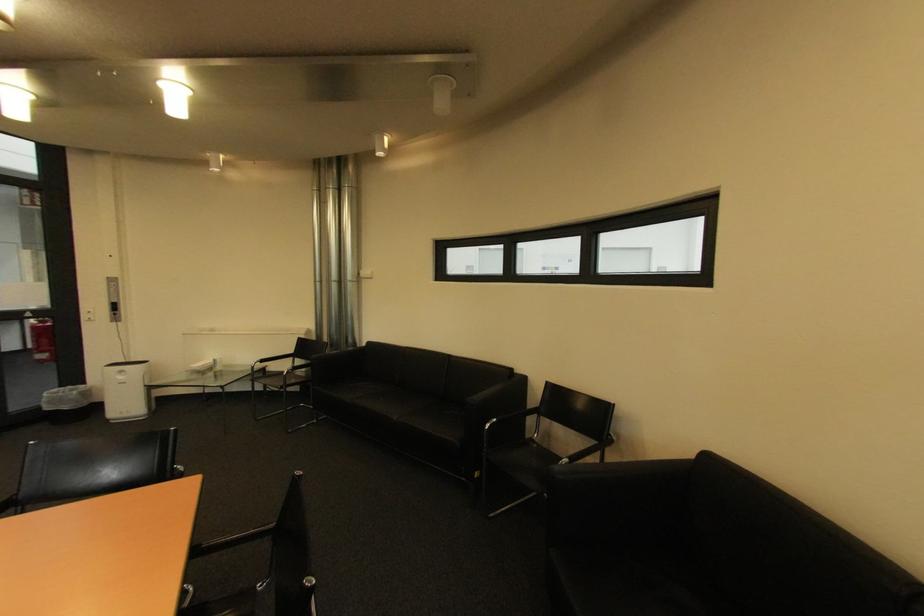
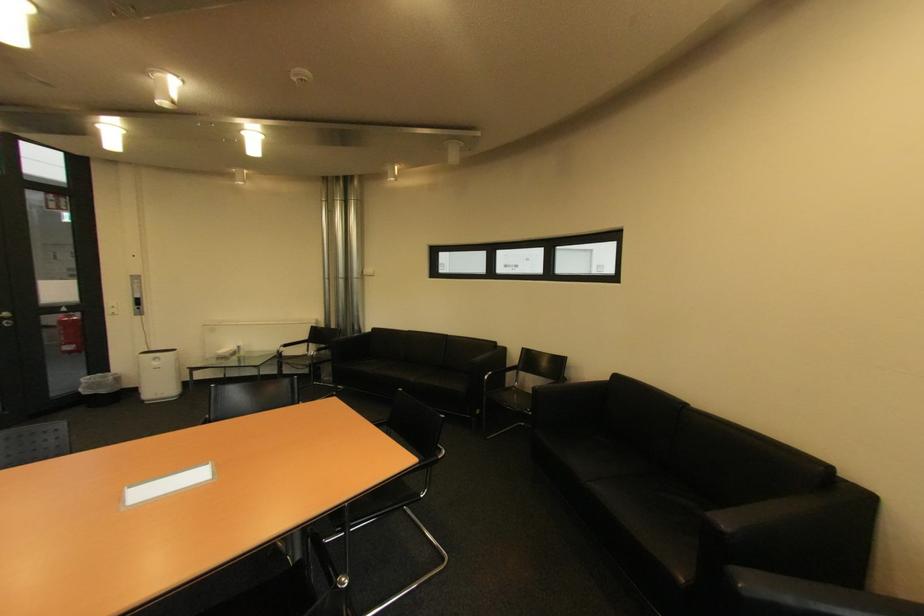
In the second image, find the point that corresponds to point 55,410 in the first image.

(94, 394)